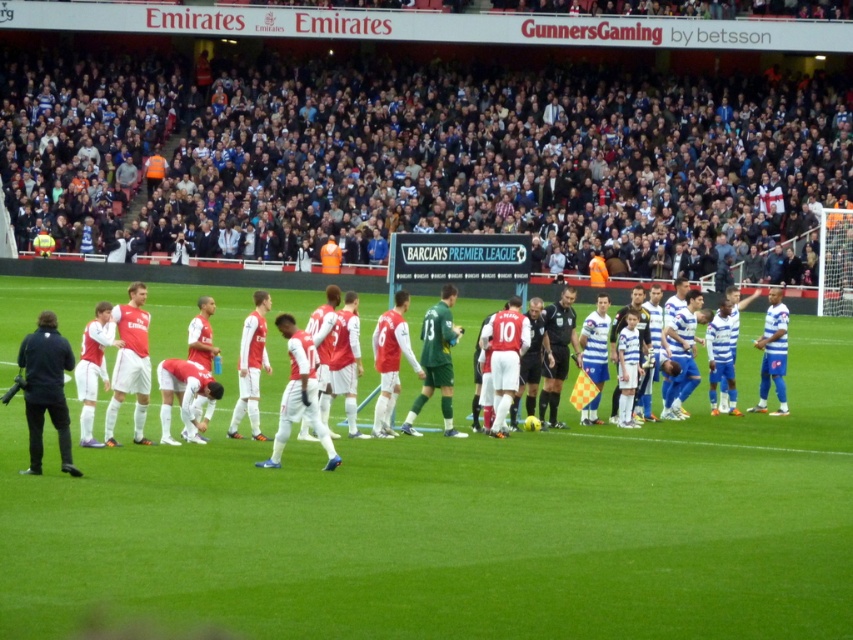
Find the location of a particular element. dark blue jersey at upper center is located at coordinates (422, 157).

Which is in front, point (796, 218) or point (422, 337)?

Point (422, 337)

Which is in front, point (676, 230) or point (444, 380)?

Point (444, 380) is more forward.

The height and width of the screenshot is (640, 853). Identify the location of dark blue jersey at upper center. (422, 157).

Is green grass field at center to the left of dark blue jersey at upper center from the viewer's perspective?

Incorrect, green grass field at center is not on the left side of dark blue jersey at upper center.

Is green grass field at center behind dark blue jersey at upper center?

No, it is in front of dark blue jersey at upper center.

Is point (42, 588) positioned behind point (119, 72)?

No, (42, 588) is in front of (119, 72).

Identify the location of green grass field at center. (453, 524).

Find the location of `dark blue jersey at upper center`. dark blue jersey at upper center is located at coordinates (422, 157).